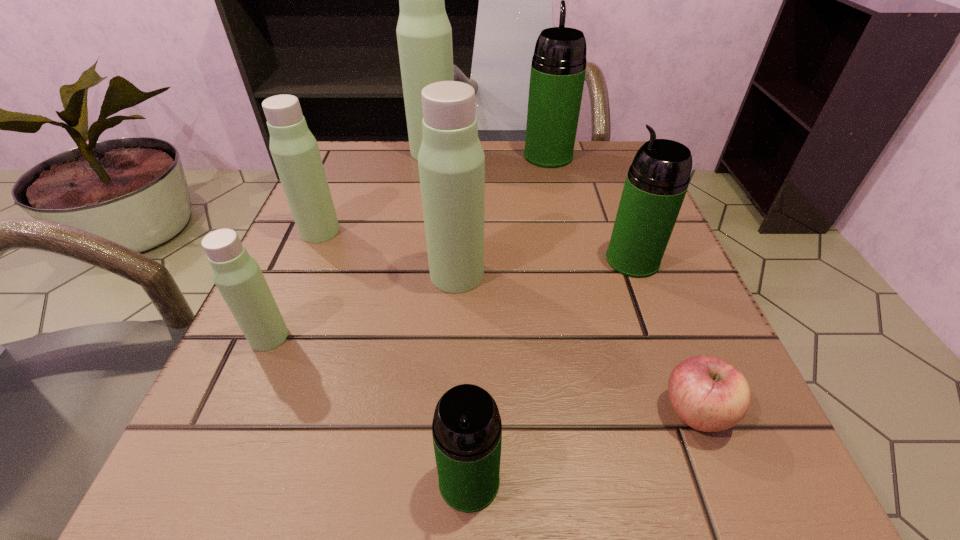
Image resolution: width=960 pixels, height=540 pixels. In order to click on free area in between the nearest light thermos bottle and the shortest object in this screenshot , I will do pyautogui.click(x=482, y=374).

Find the location of a particular element. The width and height of the screenshot is (960, 540). free space between the biggest light thermos bottle and the nearest light thermos bottle is located at coordinates (351, 244).

Point out which object is positioned as the fourth nearest to the second biggest green thermos bottle. Please provide its 2D coordinates. Your answer should be formatted as a tuple, i.e. [(x, y)], where the tuple contains the x and y coordinates of a point satisfying the conditions above.

[(467, 430)]

Locate an element on the screen. The width and height of the screenshot is (960, 540). object that is the nearest to the sixth farthest thermos bottle is located at coordinates (294, 149).

Identify which thermos bottle is located as the fifth nearest to the sixth farthest thermos bottle. Please provide its 2D coordinates. Your answer should be formatted as a tuple, i.e. [(x, y)], where the tuple contains the x and y coordinates of a point satisfying the conditions above.

[(657, 181)]

Locate an element on the screen. the third closest thermos bottle relative to the sixth thermos bottle from left to right is located at coordinates (451, 161).

What are the coordinates of `the third closest light thermos bottle relative to the second biggest light thermos bottle` in the screenshot? It's located at (424, 35).

Point out which light thermos bottle is positioned as the nearest to the tallest thermos bottle. Please provide its 2D coordinates. Your answer should be formatted as a tuple, i.e. [(x, y)], where the tuple contains the x and y coordinates of a point satisfying the conditions above.

[(294, 149)]

This screenshot has width=960, height=540. I want to click on the closest green thermos bottle to the second smallest light thermos bottle, so click(x=558, y=68).

The height and width of the screenshot is (540, 960). I want to click on green thermos bottle that stands as the second closest to the smallest green thermos bottle, so click(558, 68).